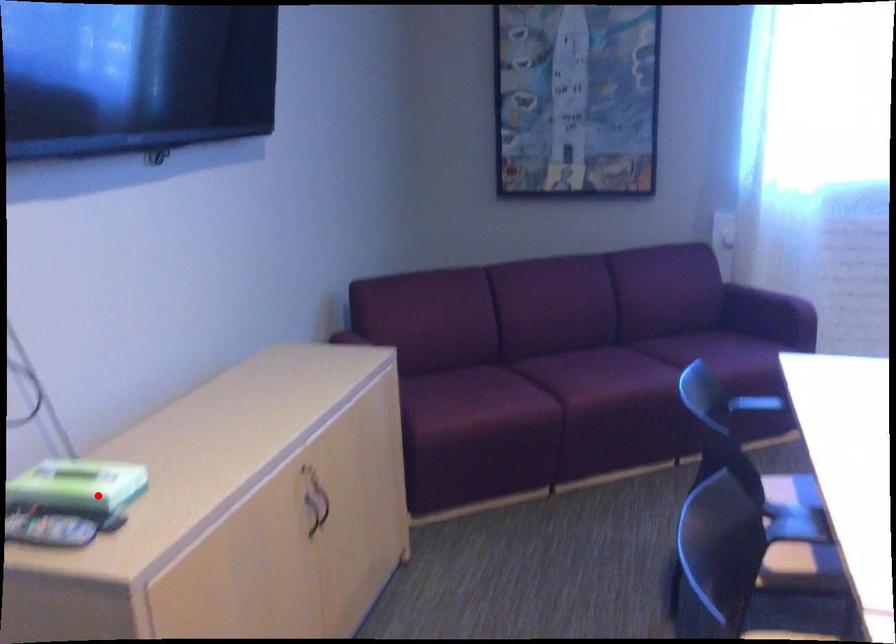
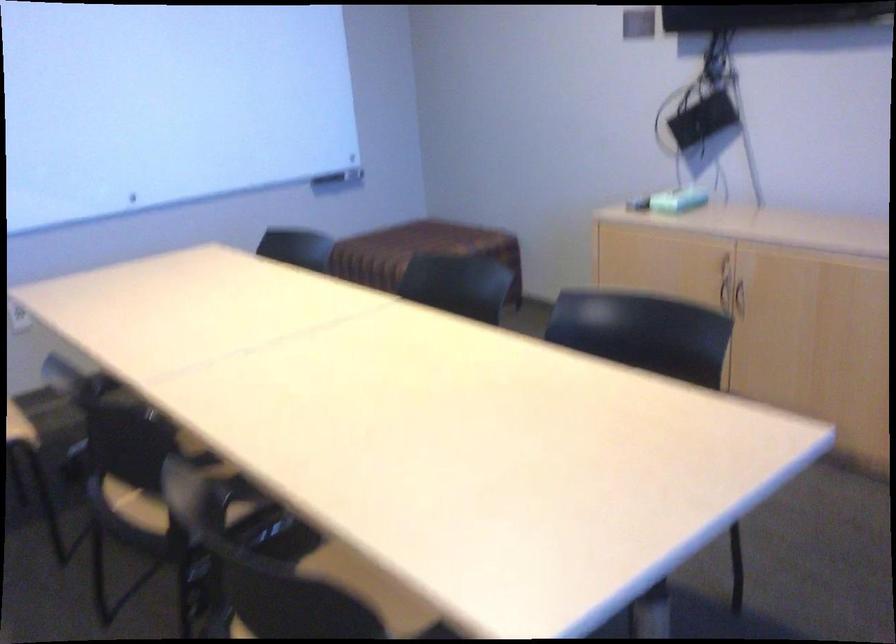
Where in the second image is the point corresponding to the highlighted location from the first image?

(677, 200)